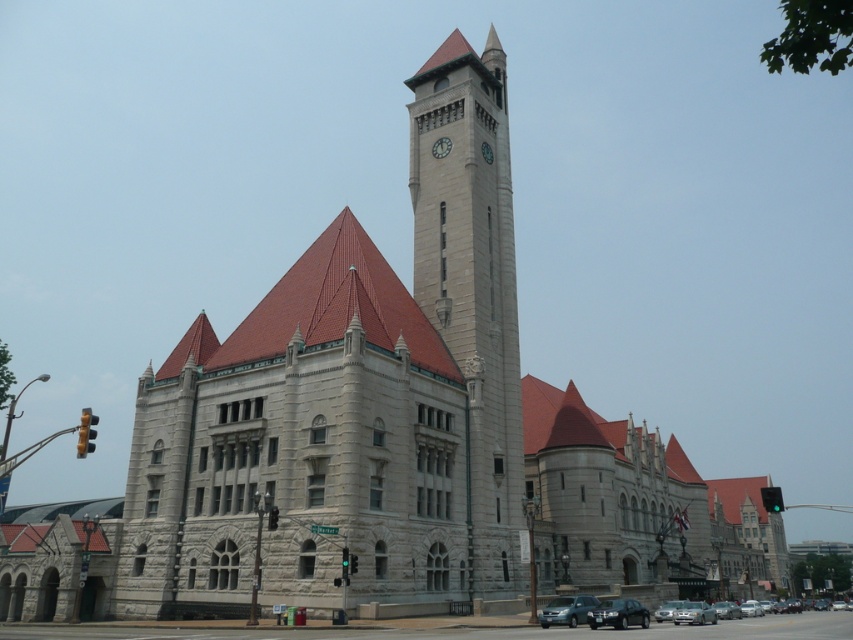
You are a photographer planning to capture the grand building with both the shiny black suv at lower center and the white stone clock at upper center in the frame. Which object will appear wider in your photo?

The shiny black suv at lower center will appear wider in the photo since its width surpasses that of the white stone clock at upper center according to the description.

You are standing in front of the grand historic building and want to take a photo of the stone clock tower at center and the metallic silver sedan at lower center. Which object will appear larger in the photo?

The stone clock tower at center will appear larger in the photo because it is closer to the viewer than the metallic silver sedan at lower center.